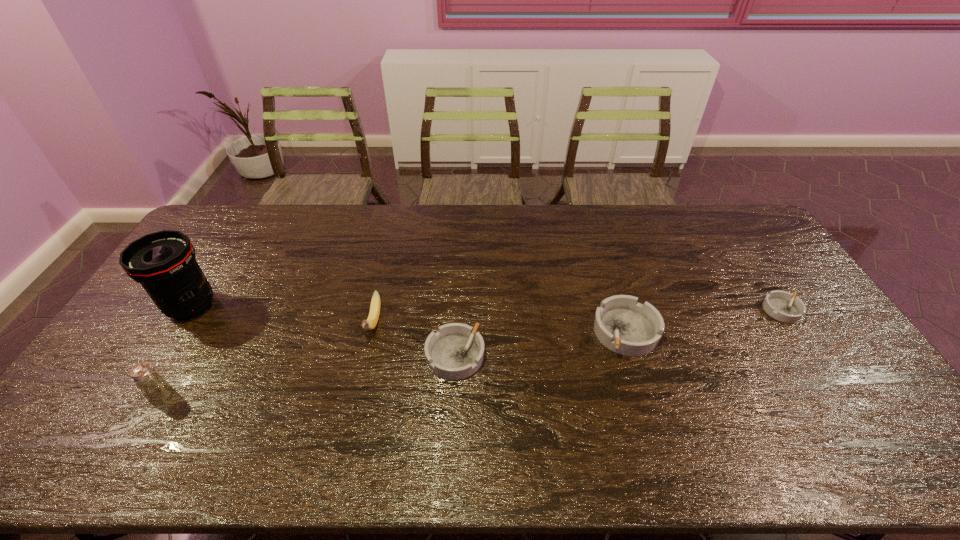
At what (x,y) coordinates should I click in order to perform the action: click on vacant spot to place a ashtray on the left. Please return your answer as a coordinate pair (x, y). The width and height of the screenshot is (960, 540). Looking at the image, I should click on (266, 382).